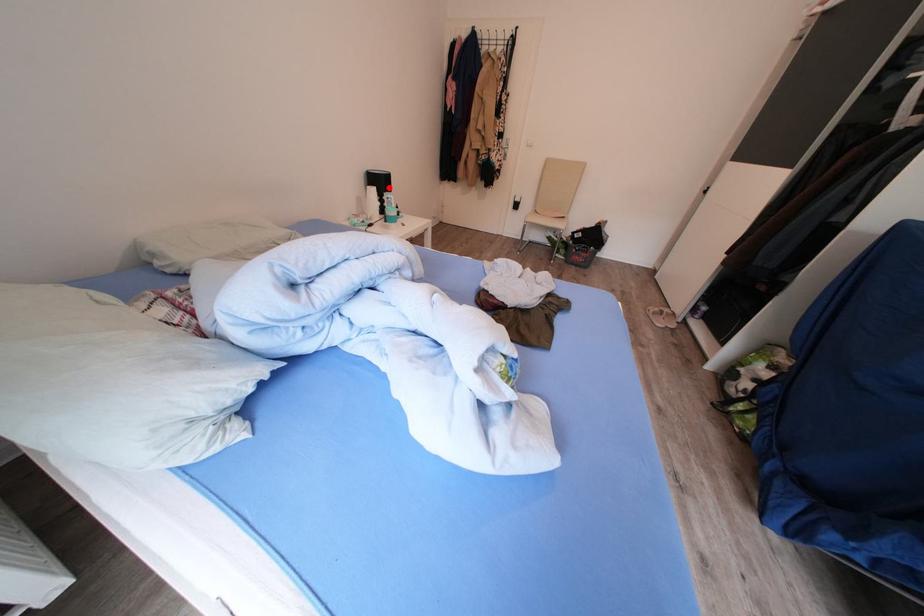
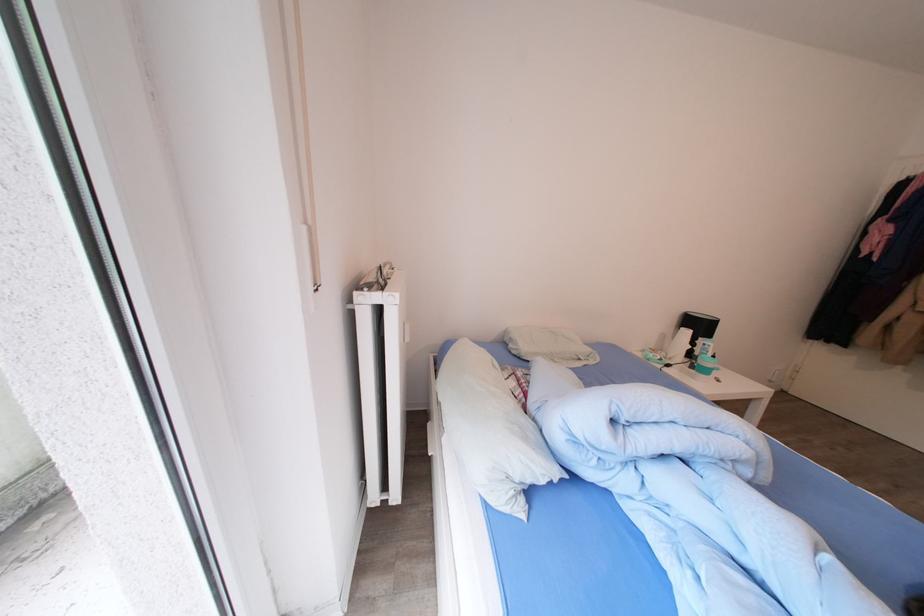
Question: I am providing you with two images of the same scene from different viewpoints. Image1 has a red point marked. In image2, the corresponding 3D location appears at what relative position? Reply with the corresponding letter.

Choices:
 (A) Closer
 (B) Farther

Answer: (B)